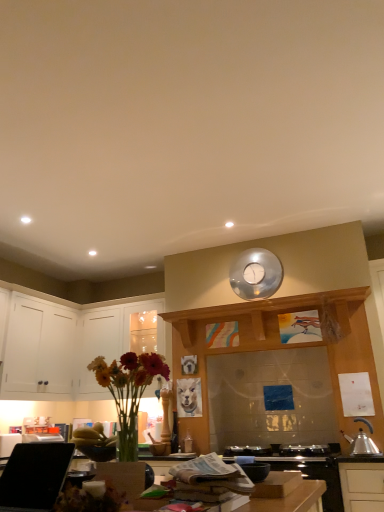
Describe the element at coordinates (361, 444) in the screenshot. I see `metallic silver kettle at lower right` at that location.

Describe the element at coordinates (256, 274) in the screenshot. I see `metallic silver clock at center` at that location.

You are a GUI agent. You are given a task and a screenshot of the screen. Output one action in this format:
    pyautogui.click(x=<x>, y=<y>)
    Task: Click on the black glass stove at lower center
    The width and height of the screenshot is (384, 512).
    Given the screenshot: What is the action you would take?
    pyautogui.click(x=312, y=471)

In order to face black glass stove at lower center, should I rotate leftwards or rightwards?

You should rotate right by 11.083 degrees.

What do you see at coordinates (39, 348) in the screenshot?
I see `white matte cabinet at left, the second cabinetry in the right-to-left sequence` at bounding box center [39, 348].

Image resolution: width=384 pixels, height=512 pixels. Find the location of `matte glass vase with flowers at lower left`. matte glass vase with flowers at lower left is located at coordinates (128, 391).

Locate an element on the screen. metallic silver kettle at lower right is located at coordinates (361, 444).

Looking at this image, considering the positions of objects wooden surface at center and white glossy cabinets at left, the first cabinetry in the right-to-left sequence, in the image provided, who is more to the left, wooden surface at center or white glossy cabinets at left, the first cabinetry in the right-to-left sequence,?

white glossy cabinets at left, the first cabinetry in the right-to-left sequence, is more to the left.

Looking at this image, is wooden surface at center not within white glossy cabinets at left, the first cabinetry in the right-to-left sequence?

wooden surface at center lies outside white glossy cabinets at left, the first cabinetry in the right-to-left sequence,'s area.

How far apart are wooden surface at center and white glossy cabinets at left, which ranks as the second cabinetry in left-to-right order?

They are 8.97 feet apart.

From a real-world perspective, is wooden surface at center positioned over white glossy cabinets at left, which ranks as the second cabinetry in left-to-right order, based on gravity?

No, from a real-world perspective, wooden surface at center is not on top of white glossy cabinets at left, which ranks as the second cabinetry in left-to-right order.

Is white glossy cabinets at left, the first cabinetry in the right-to-left sequence, looking in the opposite direction of metallic silver kettle at lower right?

No, white glossy cabinets at left, the first cabinetry in the right-to-left sequence, is not facing away from metallic silver kettle at lower right.

This screenshot has width=384, height=512. I want to click on kitchen appliance located on the right of white glossy cabinets at left, which ranks as the second cabinetry in left-to-right order, so click(361, 444).

Between point (117, 317) and point (358, 445), which one is positioned in front?

Point (358, 445)

Is metallic silver clock at center beside black glass stove at lower center?

No, metallic silver clock at center is not beside black glass stove at lower center.

Considering the relative sizes of metallic silver clock at center and black glass stove at lower center in the image provided, is metallic silver clock at center shorter than black glass stove at lower center?

Indeed, metallic silver clock at center has a lesser height compared to black glass stove at lower center.

Which is behind, point (244, 279) or point (275, 470)?

The point (244, 279) is behind.

At what (x,y) coordinates should I click in order to perform the action: click on clock behind the black glass stove at lower center. Please return your answer as a coordinate pair (x, y). The height and width of the screenshot is (512, 384). Looking at the image, I should click on (256, 274).

Is metallic silver clock at center wider or thinner than white glossy cabinets at left, which ranks as the second cabinetry in left-to-right order?

metallic silver clock at center is thinner than white glossy cabinets at left, which ranks as the second cabinetry in left-to-right order.

Which is more to the left, metallic silver clock at center or white glossy cabinets at left, the first cabinetry in the right-to-left sequence?

Positioned to the left is white glossy cabinets at left, the first cabinetry in the right-to-left sequence.

Who is taller, metallic silver clock at center or white glossy cabinets at left, the first cabinetry in the right-to-left sequence?

white glossy cabinets at left, the first cabinetry in the right-to-left sequence, is taller.

Do you think metallic silver clock at center is within white glossy cabinets at left, which ranks as the second cabinetry in left-to-right order, or outside of it?

metallic silver clock at center is located beyond the bounds of white glossy cabinets at left, which ranks as the second cabinetry in left-to-right order.

From the image's perspective, which is below, metallic silver clock at center or matte glass vase with flowers at lower left?

From the image's view, matte glass vase with flowers at lower left is below.

Considering the sizes of objects metallic silver clock at center and matte glass vase with flowers at lower left in the image provided, who is thinner, metallic silver clock at center or matte glass vase with flowers at lower left?

metallic silver clock at center is thinner.

Measure the distance between metallic silver clock at center and matte glass vase with flowers at lower left.

A distance of 1.81 meters exists between metallic silver clock at center and matte glass vase with flowers at lower left.

Which is behind, metallic silver clock at center or matte glass vase with flowers at lower left?

metallic silver clock at center is more distant.

Which object is positioned more to the left, white glossy cabinets at left, which ranks as the second cabinetry in left-to-right order, or black glass stove at lower center?

white glossy cabinets at left, which ranks as the second cabinetry in left-to-right order, is more to the left.

From the image's perspective, is white glossy cabinets at left, which ranks as the second cabinetry in left-to-right order, over black glass stove at lower center?

Correct, white glossy cabinets at left, which ranks as the second cabinetry in left-to-right order, appears higher than black glass stove at lower center in the image.

Relative to black glass stove at lower center, is white glossy cabinets at left, the first cabinetry in the right-to-left sequence, in front or behind?

In the image, white glossy cabinets at left, the first cabinetry in the right-to-left sequence, appears behind black glass stove at lower center.

Is point (13, 342) closer or farther from the camera than point (109, 346)?

Point (13, 342) appears to be closer to the viewer than point (109, 346).

From the picture: Is white matte cabinet at left, acting as the 1th cabinetry starting from the left, shorter than white glossy cabinets at left, the first cabinetry in the right-to-left sequence?

Correct, white matte cabinet at left, acting as the 1th cabinetry starting from the left, is not as tall as white glossy cabinets at left, the first cabinetry in the right-to-left sequence.

What's the angular difference between white matte cabinet at left, the second cabinetry in the right-to-left sequence, and white glossy cabinets at left, which ranks as the second cabinetry in left-to-right order,'s facing directions?

The angle between the facing direction of white matte cabinet at left, the second cabinetry in the right-to-left sequence, and the facing direction of white glossy cabinets at left, which ranks as the second cabinetry in left-to-right order, is 89.5 degrees.

Starting from the wooden surface at center, which cabinetry is the 1st one to the left? Please provide its 2D coordinates.

[(117, 338)]

You are a GUI agent. You are given a task and a screenshot of the screen. Output one action in this format:
    pyautogui.click(x=<x>, y=<y>)
    Task: Click on the kitchen appliance in front of the white glossy cabinets at left, which ranks as the second cabinetry in left-to-right order
    
    Given the screenshot: What is the action you would take?
    pyautogui.click(x=361, y=444)

Looking at the image, which one is located closer to matte glass vase with flowers at lower left, metallic silver kettle at lower right or black glass stove at lower center?

black glass stove at lower center lies closer to matte glass vase with flowers at lower left than the other object.

Based on the photo, looking at the image, which one is located closer to wooden surface at center, metallic silver kettle at lower right or matte glass vase with flowers at lower left?

matte glass vase with flowers at lower left.

Which object lies further to the anchor point white matte cabinet at left, the second cabinetry in the right-to-left sequence, white glossy cabinets at left, the first cabinetry in the right-to-left sequence, or matte glass vase with flowers at lower left?

matte glass vase with flowers at lower left.

From the image, which object appears to be farther from white matte cabinet at left, acting as the 1th cabinetry starting from the left, metallic silver kettle at lower right or white glossy cabinets at left, the first cabinetry in the right-to-left sequence?

metallic silver kettle at lower right is further to white matte cabinet at left, acting as the 1th cabinetry starting from the left.

Which object lies nearer to the anchor point white matte cabinet at left, the second cabinetry in the right-to-left sequence, matte glass vase with flowers at lower left or white glossy cabinets at left, the first cabinetry in the right-to-left sequence?

white glossy cabinets at left, the first cabinetry in the right-to-left sequence, lies closer to white matte cabinet at left, the second cabinetry in the right-to-left sequence, than the other object.

From the picture: When comparing their distances from white glossy cabinets at left, the first cabinetry in the right-to-left sequence, does matte glass vase with flowers at lower left or metallic silver clock at center seem closer?

metallic silver clock at center lies closer to white glossy cabinets at left, the first cabinetry in the right-to-left sequence, than the other object.

Looking at the image, which one is located further to matte glass vase with flowers at lower left, metallic silver clock at center or white matte cabinet at left, the second cabinetry in the right-to-left sequence?

Among the two, white matte cabinet at left, the second cabinetry in the right-to-left sequence, is located further to matte glass vase with flowers at lower left.

Estimate the real-world distances between objects in this image. Which object is closer to matte glass vase with flowers at lower left, white matte cabinet at left, acting as the 1th cabinetry starting from the left, or wooden surface at center?

Based on the image, wooden surface at center appears to be nearer to matte glass vase with flowers at lower left.

Locate an element on the screen. Image resolution: width=384 pixels, height=512 pixels. kitchen appliance located between matte glass vase with flowers at lower left and white glossy cabinets at left, the first cabinetry in the right-to-left sequence, in the depth direction is located at coordinates (361, 444).

Image resolution: width=384 pixels, height=512 pixels. What are the coordinates of `floral arrangement between wooden surface at center and metallic silver kettle at lower right in the front-back direction` in the screenshot? It's located at (128, 391).

Locate an element on the screen. counter top located between white matte cabinet at left, the second cabinetry in the right-to-left sequence, and black glass stove at lower center in the left-right direction is located at coordinates (286, 494).

Where is `floral arrangement between white matte cabinet at left, the second cabinetry in the right-to-left sequence, and metallic silver kettle at lower right, in the horizontal direction`? floral arrangement between white matte cabinet at left, the second cabinetry in the right-to-left sequence, and metallic silver kettle at lower right, in the horizontal direction is located at coordinates (128, 391).